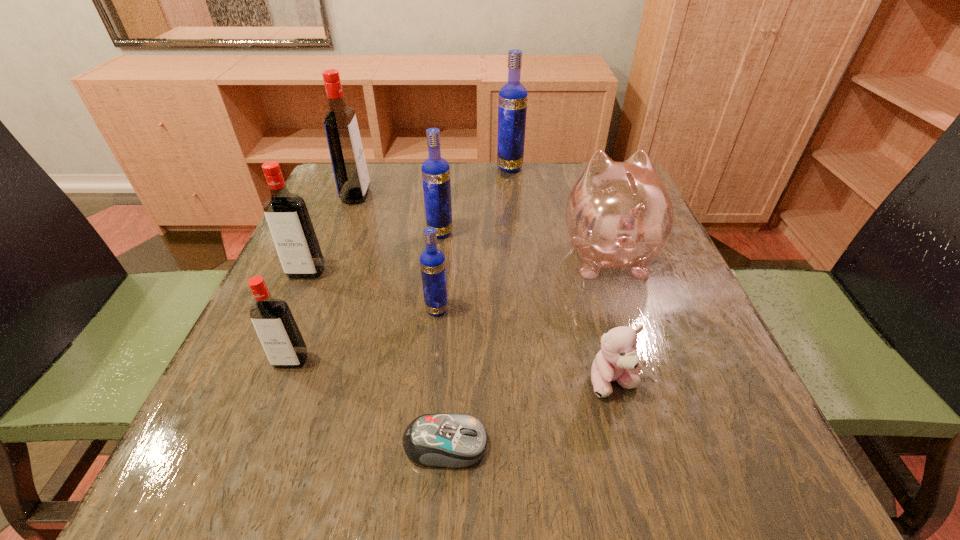
Locate an element on the screen. free space between the pink teddy bear and the second smallest red vodka is located at coordinates (460, 327).

Find the location of a particular element. free spot between the fourth farthest vodka and the computer mouse is located at coordinates (376, 358).

The width and height of the screenshot is (960, 540). Find the location of `vacant area between the nearest vodka and the third nearest vodka`. vacant area between the nearest vodka and the third nearest vodka is located at coordinates pos(299,316).

Locate an element on the screen. The width and height of the screenshot is (960, 540). vacant space that's between the nearest vodka and the second farthest vodka is located at coordinates (324, 278).

Find the location of `empty space that is in between the nearest object and the eighth tallest object`. empty space that is in between the nearest object and the eighth tallest object is located at coordinates (530, 414).

This screenshot has width=960, height=540. Identify the location of empty location between the shortest object and the pink teddy bear. (530, 414).

Locate an element on the screen. This screenshot has width=960, height=540. unoccupied area between the second farthest object and the nearest red vodka is located at coordinates (324, 278).

Locate an element on the screen. The width and height of the screenshot is (960, 540). vacant area that lies between the second smallest red vodka and the nearest blue vodka is located at coordinates (372, 291).

Where is `object that is the seventh closest to the piggy bank`? The image size is (960, 540). object that is the seventh closest to the piggy bank is located at coordinates (280, 337).

Identify which object is the closest to the smallest red vodka. Please provide its 2D coordinates. Your answer should be formatted as a tuple, i.e. [(x, y)], where the tuple contains the x and y coordinates of a point satisfying the conditions above.

[(286, 214)]